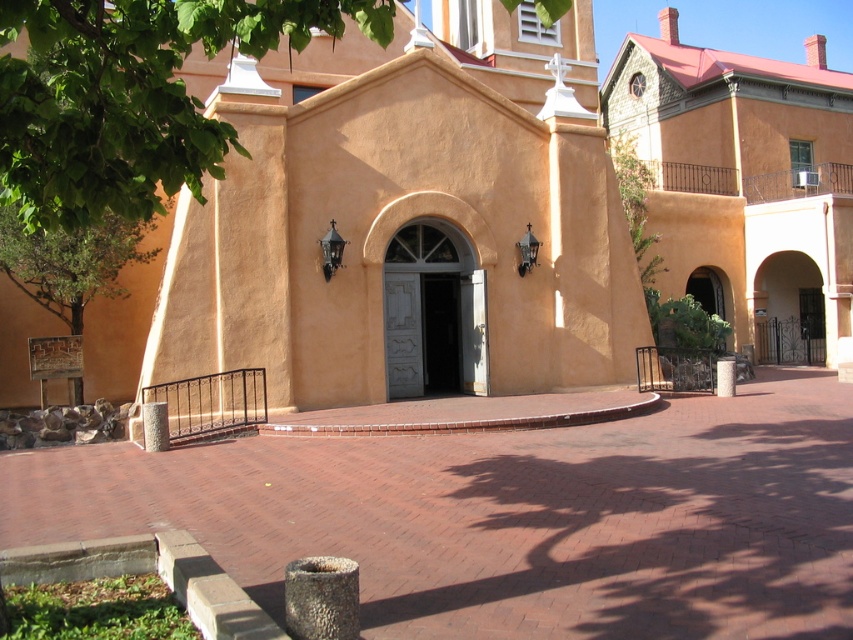
Question: Is the position of white painted wood door at center more distant than that of black matte door at center?

Choices:
 (A) no
 (B) yes

Answer: (A)

Question: Is matte orange building at center wider than green leafy tree at left?

Choices:
 (A) no
 (B) yes

Answer: (B)

Question: Considering the real-world distances, which object is farthest from the green leafy tree at upper left?

Choices:
 (A) green leafy tree at left
 (B) white painted wood door at center

Answer: (B)

Question: Among these points, which one is nearest to the camera?

Choices:
 (A) (50, 230)
 (B) (50, 22)
 (C) (364, 388)
 (D) (444, 328)

Answer: (B)

Question: Which object appears closest to the camera in this image?

Choices:
 (A) green leafy tree at left
 (B) white painted wood door at center
 (C) matte orange building at center
 (D) black matte door at center

Answer: (A)

Question: Considering the relative positions of matte orange stucco chapel at center and green leafy tree at upper left in the image provided, where is matte orange stucco chapel at center located with respect to green leafy tree at upper left?

Choices:
 (A) below
 (B) above

Answer: (B)